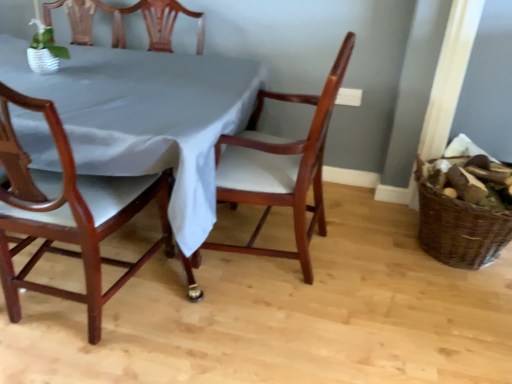
This screenshot has height=384, width=512. Identify the location of free space in front of brown woven basket at right. (462, 310).